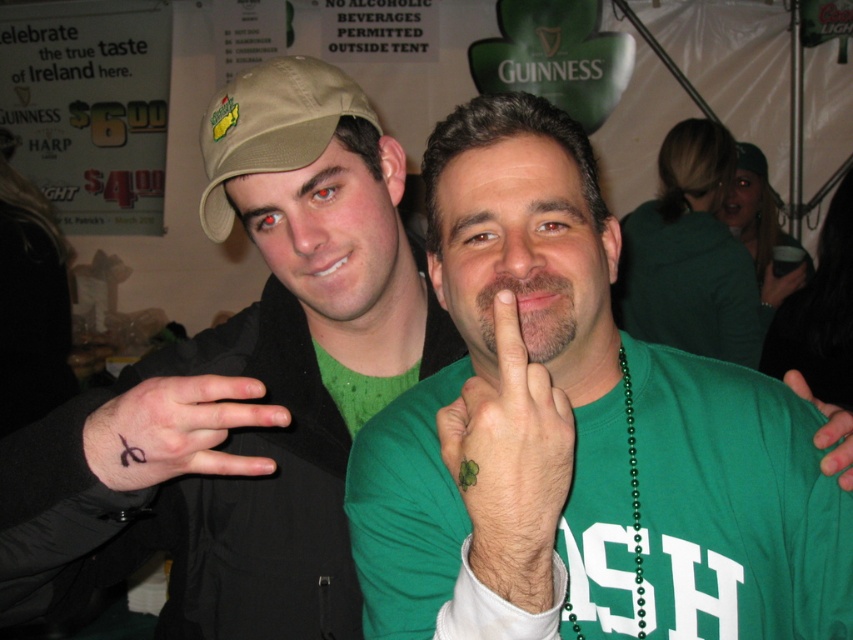
You are a photographer trying to capture the perfect shot of the green matte hand at center and the green fabric at center. Which object should you focus on first if you want to ensure both are in frame?

The green matte hand at center is positioned on the left side of green fabric at center, so you should focus on the green matte hand at center first to ensure both are in frame.

You are organizing a St. Patrick Day parade and need to decide which item to place first in a display case. The matte green shirt at center and the green fabric at center are both candidates. Based on their sizes, which one should you place first to maximize space efficiency?

The matte green shirt at center has a larger width than the green fabric at center, so you should place the matte green shirt at center first to accommodate its larger size before arranging the smaller green fabric at center.

You are a photographer at the event and need to adjust the camera focus. The matte green shirt at center and green fabric at center are part of the scene. Which object is closer to the camera?

The matte green shirt at center and green fabric at center are 19.68 inches apart from each other, so without additional information about their positions relative to the camera, it is impossible to determine which is closer based solely on the distance between them.